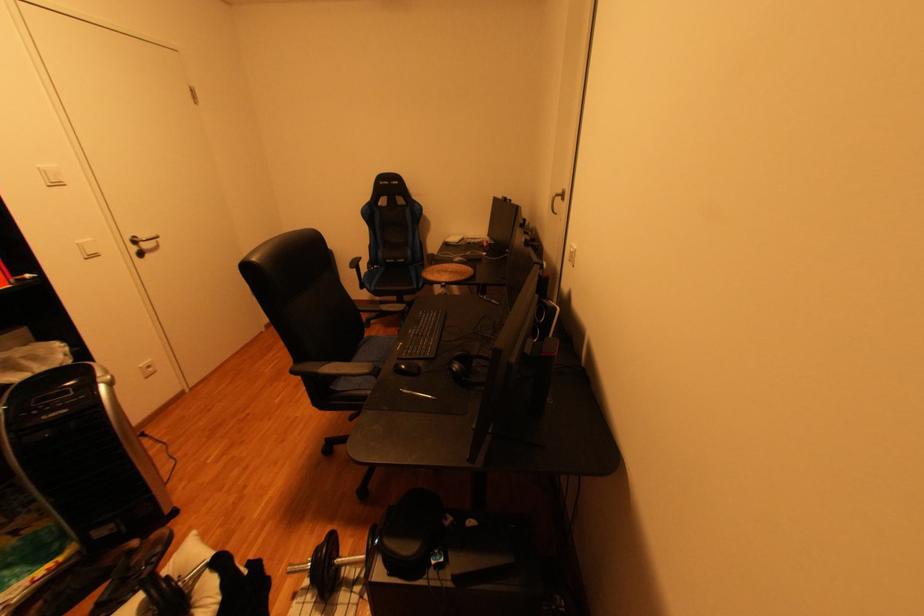
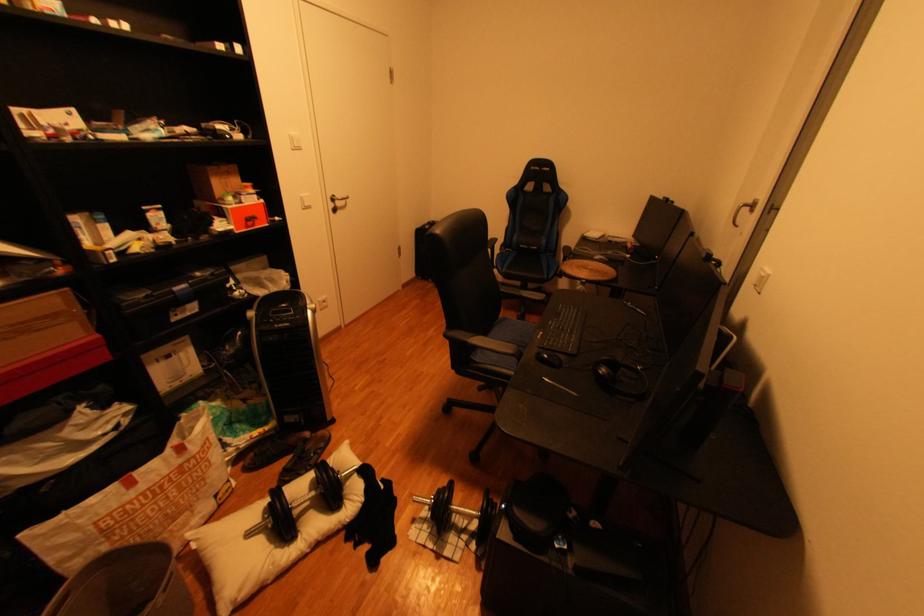
Find the pixel in the second image that matches pixel 380 339 in the first image.

(515, 320)